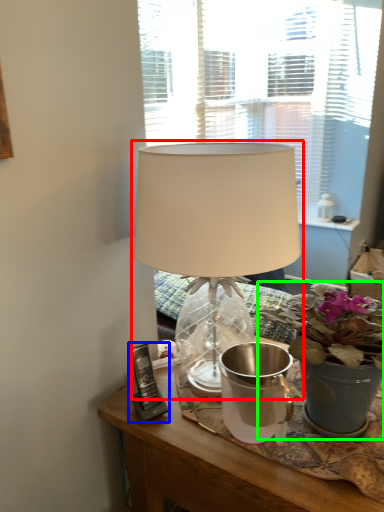
Question: Which object is the closest to the lamp (highlighted by a red box)? Choose among these: gadget (highlighted by a blue box) or houseplant (highlighted by a green box).

Choices:
 (A) gadget
 (B) houseplant

Answer: (B)